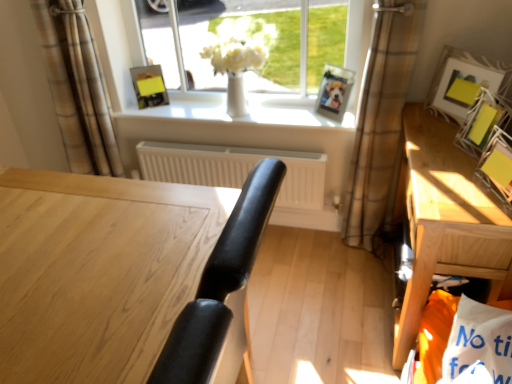
Question: Relative to matte yellow picture frame at right, marked as the 2th picture frame in a front-to-back arrangement, is white glossy vase at center in front or behind?

Choices:
 (A) front
 (B) behind

Answer: (B)

Question: From the image's perspective, is white glossy vase at center located above or below matte yellow picture frame at right, the fourth picture frame viewed from the left?

Choices:
 (A) below
 (B) above

Answer: (B)

Question: Considering the real-world distances, which object is closest to the white matte radiator at center?

Choices:
 (A) white glossy window sill at center
 (B) wooden photo frame at upper center, which appears as the 4th picture frame when viewed from the right
 (C) yellow paper at upper right, the 1th picture frame from the front
 (D) wooden desk at center
 (E) wooden table at right

Answer: (A)

Question: Which is nearer to the white glossy window sill at center?

Choices:
 (A) brown plaid curtain at center right, the 2th curtain viewed from the left
 (B) white glossy vase at center
 (C) white matte radiator at center
 (D) wooden desk at center
 (E) matte yellow picture frame at right, the 2th picture frame when ordered from right to left

Answer: (B)